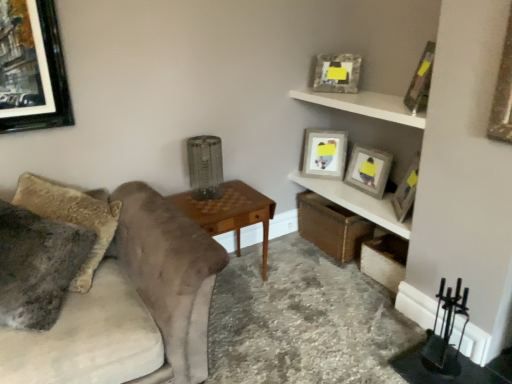
Locate an element on the screen. free space in front of woodenobject at center is located at coordinates (246, 327).